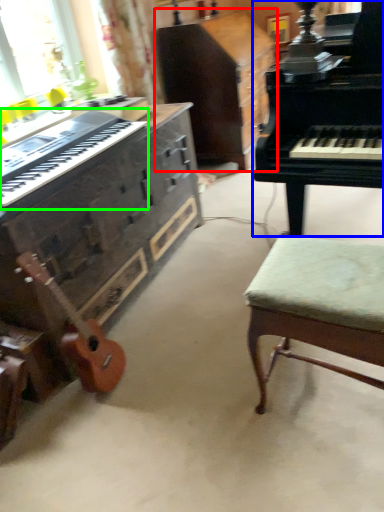
Question: Which object is positioned closest to cabinetry (highlighted by a red box)? Select from piano (highlighted by a blue box) and musical keyboard (highlighted by a green box).

Choices:
 (A) piano
 (B) musical keyboard

Answer: (A)